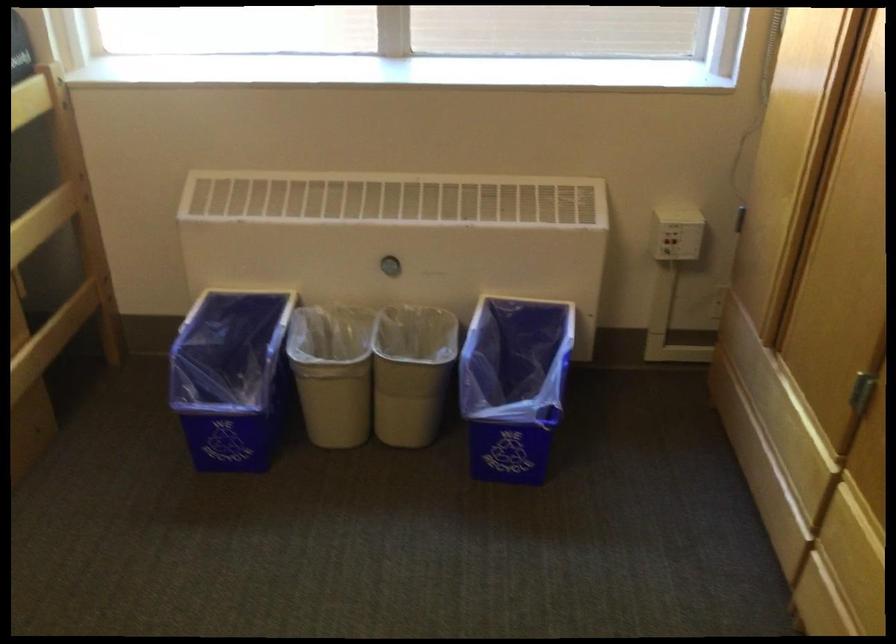
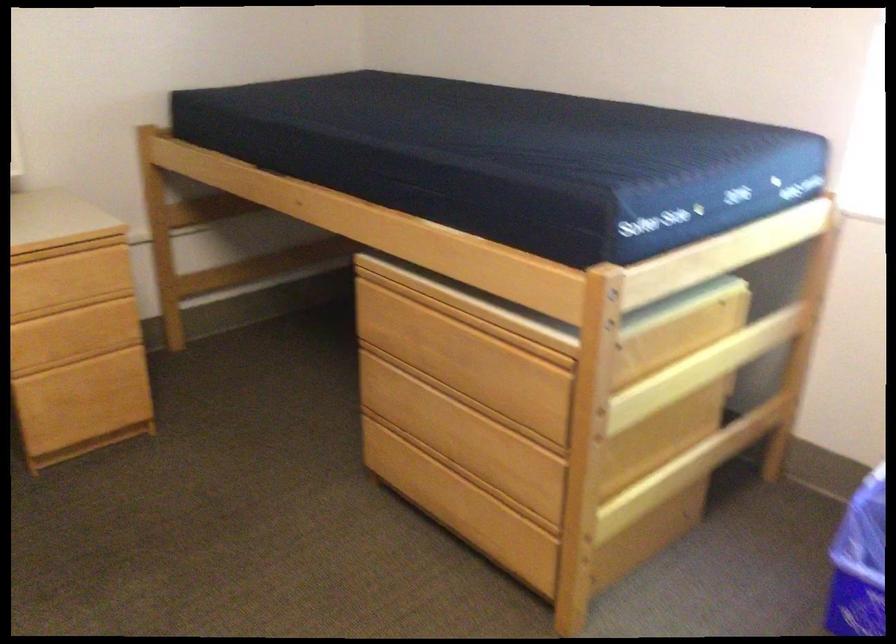
In the second image, find the point that corresponds to the point at 191,397 in the first image.

(858, 563)